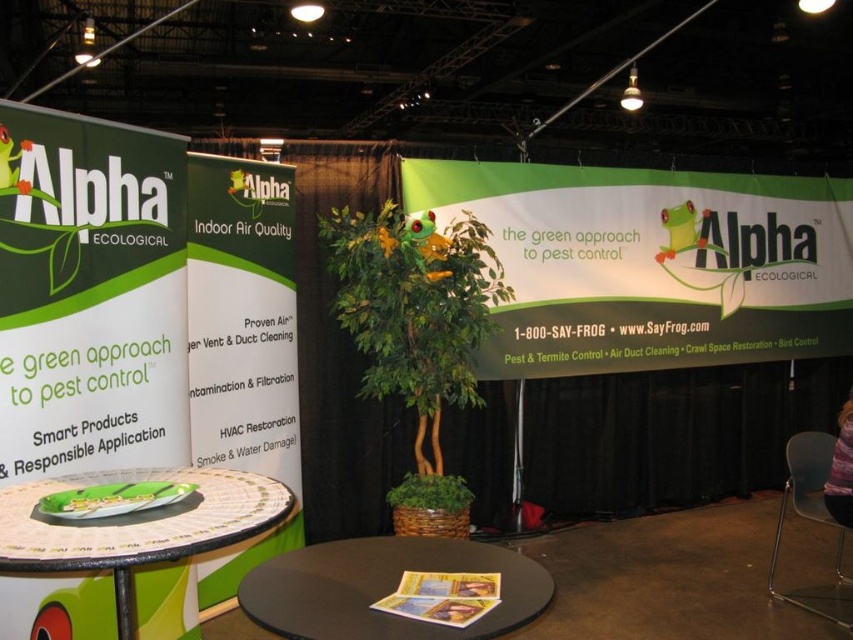
You are setting up a promotional display at the Alpha Ecological booth. You have a black matte round table at center and a green glossy plate at center. Which object has a larger width?

The black matte round table at center has a larger width than the green glossy plate at center according to the description.

You are standing at the Alpha Ecological trade show booth and want to locate two points marked on the banner. The first point is at coordinates point (340, 588) and the second is at point (811, 481). Which of these points is closer to you?

Point (340, 588) is closer to the viewer than point (811, 481) according to the description.

You are organizing a trade show booth for Alpha Ecological and need to place a promotional item on the black matte round table at center and the green glossy plate at center. Since space is limited, which object should you place the item on to ensure it fits better?

The green glossy plate at center has more space available compared to the black matte round table at center, so placing the promotional item on the green glossy plate at center would ensure it fits better.